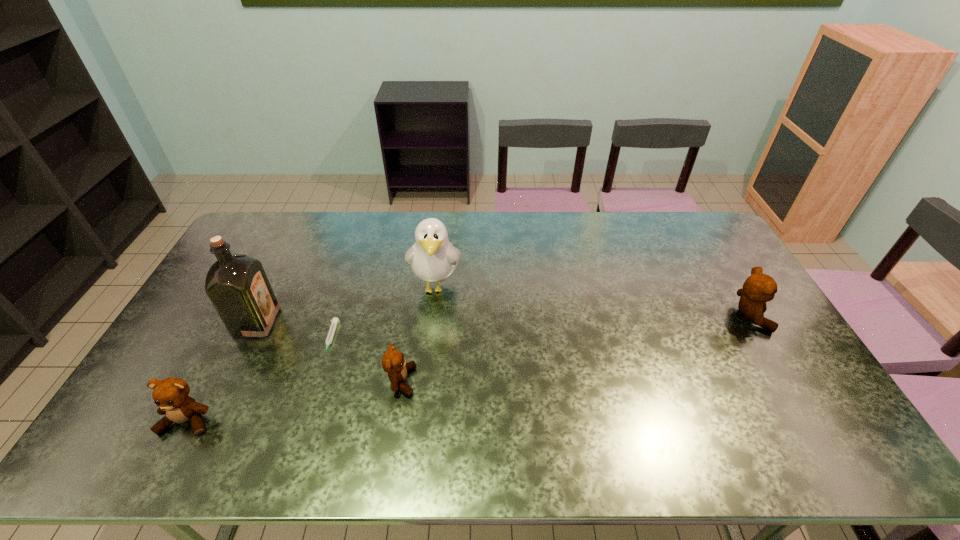
Locate an element on the screen. free space that satisfies the following two spatial constraints: 1. on the front-facing side of the second shortest object; 2. on the front-facing side of the leftmost teddy bear is located at coordinates (396, 421).

I want to click on vacant space that satisfies the following two spatial constraints: 1. on the label of the liquor; 2. on the front-facing side of the third shortest object, so click(x=209, y=421).